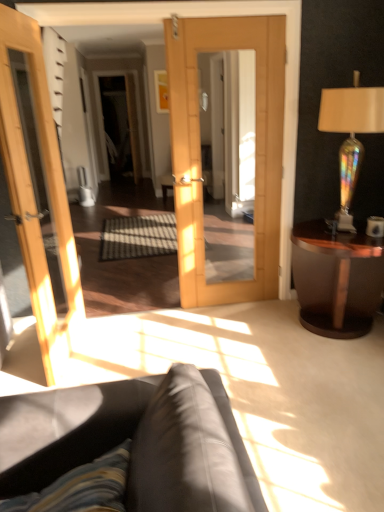
Question: Does leather couch at lower center have a smaller size compared to iridescent glass lamp at right?

Choices:
 (A) no
 (B) yes

Answer: (A)

Question: From the image's perspective, is leather couch at lower center below iridescent glass lamp at right?

Choices:
 (A) yes
 (B) no

Answer: (A)

Question: Does leather couch at lower center have a lesser height compared to iridescent glass lamp at right?

Choices:
 (A) yes
 (B) no

Answer: (A)

Question: Is iridescent glass lamp at right at the back of leather couch at lower center?

Choices:
 (A) no
 (B) yes

Answer: (A)

Question: Can you confirm if leather couch at lower center is wider than iridescent glass lamp at right?

Choices:
 (A) no
 (B) yes

Answer: (B)

Question: Is leather couch at lower center far away from iridescent glass lamp at right?

Choices:
 (A) no
 (B) yes

Answer: (B)

Question: Does iridescent glass lamp at right have a greater height compared to leather couch at lower center?

Choices:
 (A) no
 (B) yes

Answer: (B)

Question: Does iridescent glass lamp at right lie in front of leather couch at lower center?

Choices:
 (A) no
 (B) yes

Answer: (A)

Question: Is iridescent glass lamp at right positioned with its back to leather couch at lower center?

Choices:
 (A) no
 (B) yes

Answer: (A)

Question: Is iridescent glass lamp at right at the right side of leather couch at lower center?

Choices:
 (A) no
 (B) yes

Answer: (B)

Question: Considering the relative positions of iridescent glass lamp at right and leather couch at lower center in the image provided, is iridescent glass lamp at right to the left of leather couch at lower center from the viewer's perspective?

Choices:
 (A) yes
 (B) no

Answer: (B)

Question: Does iridescent glass lamp at right have a lesser width compared to leather couch at lower center?

Choices:
 (A) no
 (B) yes

Answer: (B)

Question: From a real-world perspective, is mahogany wood side table at right physically above matte white cup at right?

Choices:
 (A) no
 (B) yes

Answer: (A)